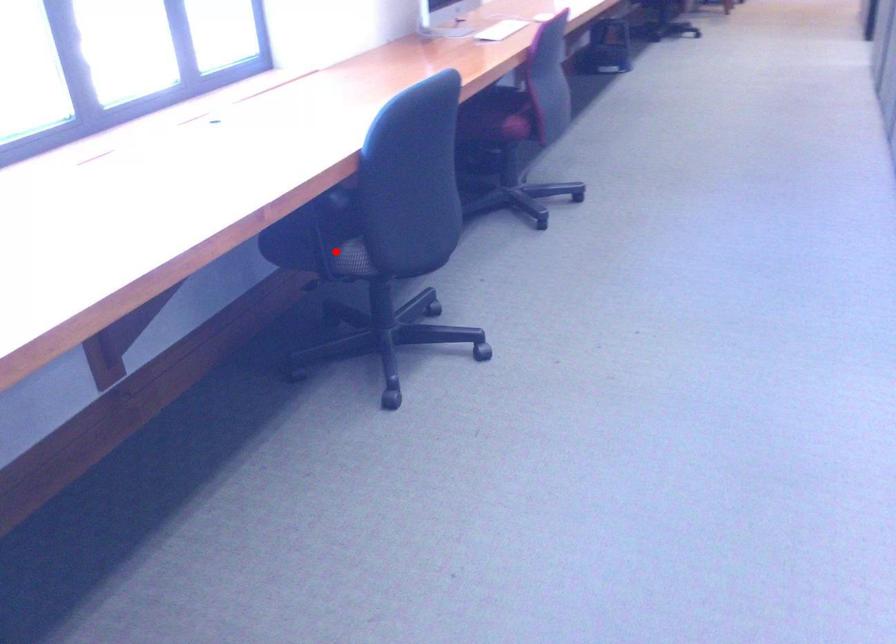
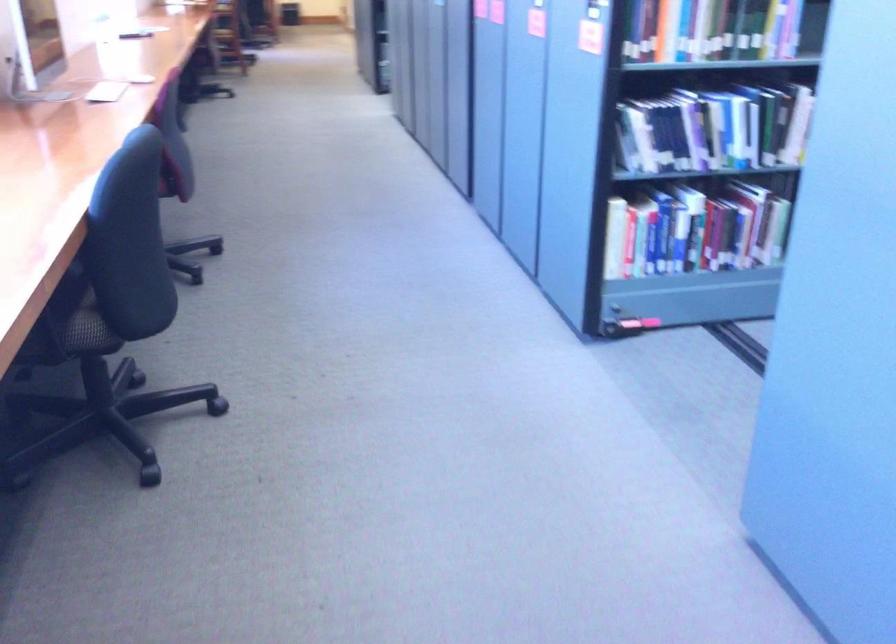
Question: I am providing you with two images of the same scene from different viewpoints. A red point is shown in image1. For the corresponding object point in image2, is it positioned nearer or farther from the camera?

Choices:
 (A) Nearer
 (B) Farther

Answer: (A)